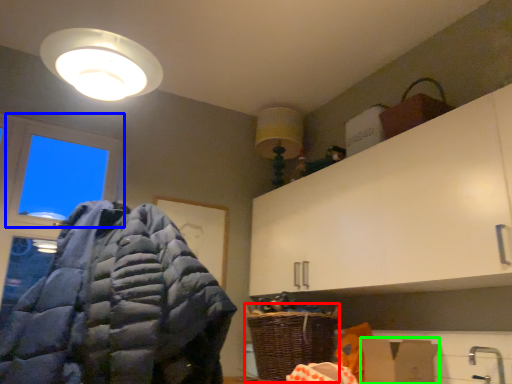
Question: Which object is the closest to the basket (highlighted by a red box)? Choose among these: window (highlighted by a blue box) or cardboard box (highlighted by a green box).

Choices:
 (A) window
 (B) cardboard box

Answer: (B)